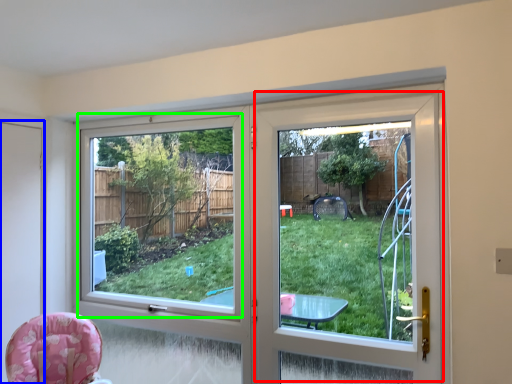
Question: Estimate the real-world distances between objects in this image. Which object is farther from screen door (highlighted by a red box), screen door (highlighted by a blue box) or window screen (highlighted by a green box)?

Choices:
 (A) screen door
 (B) window screen

Answer: (B)